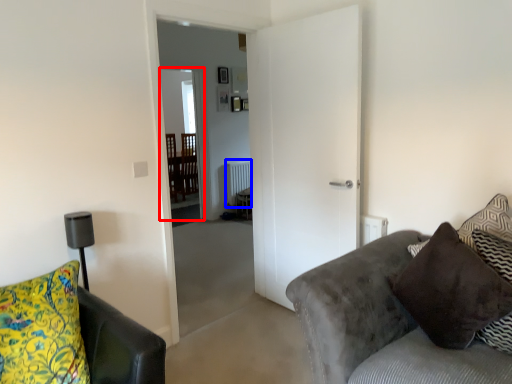
Question: Which of the following is the closest to the observer, glass door (highlighted by a red box) or radiator (highlighted by a blue box)?

Choices:
 (A) glass door
 (B) radiator

Answer: (A)